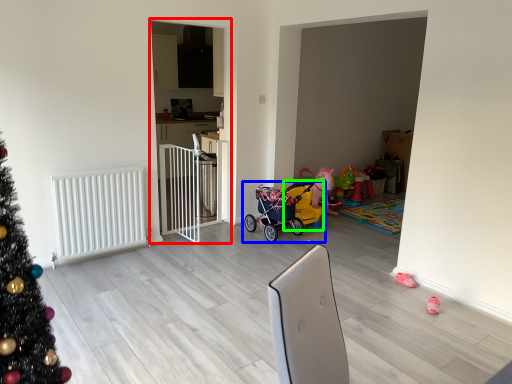
Question: Which is farther away from screen door (highlighted by a red box)? toy (highlighted by a blue box) or baby carriage (highlighted by a green box)?

Choices:
 (A) toy
 (B) baby carriage

Answer: (B)